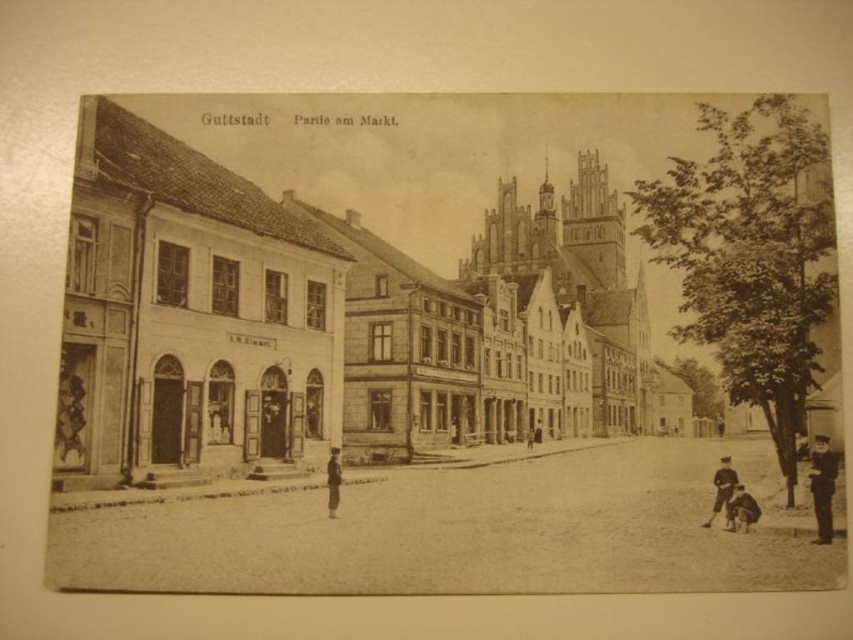
Between stone church at center and uniformed man at right, which one appears on the right side from the viewer's perspective?

Positioned to the right is uniformed man at right.

Is point (184, 392) positioned after point (827, 452)?

Yes.

I want to click on stone church at center, so 357,282.

Does stone church at center have a greater width compared to dark brown leather jacket at lower right?

Indeed, stone church at center has a greater width compared to dark brown leather jacket at lower right.

Who is higher up, stone church at center or dark brown leather jacket at lower right?

Positioned higher is stone church at center.

Who is more forward, (155, 317) or (732, 504)?

Point (732, 504) is in front.

Locate an element on the screen. stone church at center is located at coordinates (357, 282).

Is uniformed man at right taller than dark brown uniform at center?

Indeed, uniformed man at right has a greater height compared to dark brown uniform at center.

Does uniformed man at right have a greater width compared to dark brown uniform at center?

Indeed, uniformed man at right has a greater width compared to dark brown uniform at center.

The image size is (853, 640). Find the location of `uniformed man at right`. uniformed man at right is located at coordinates (822, 486).